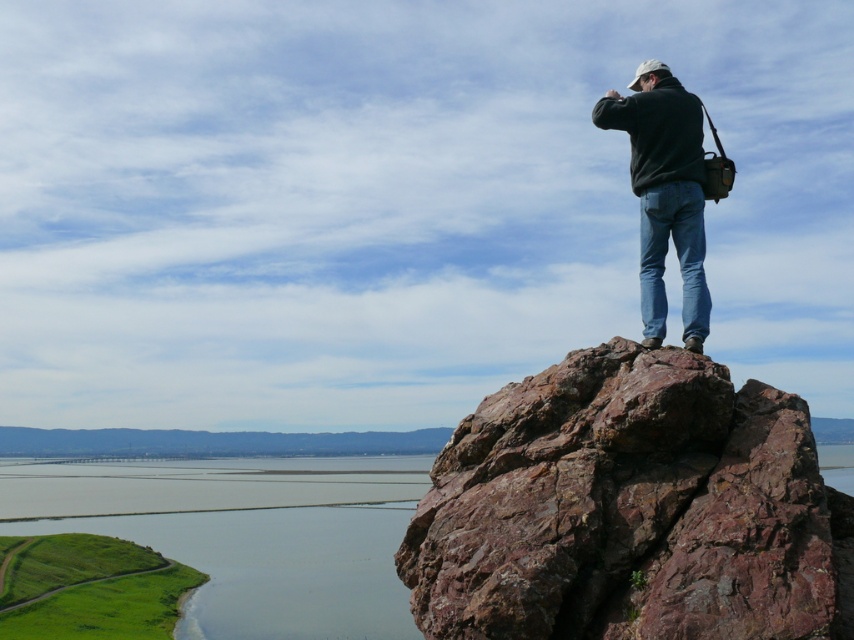
You are a photographer planning to capture the rusty rock at upper right and the black matte jacket at upper right in the same frame. Given their sizes, which object should you focus on first to ensure both are in the frame without moving the camera?

The rusty rock at upper right is wider than the black matte jacket at upper right, so you should focus on the rusty rock at upper right first to ensure both fit in the frame.

You are a hiker who wants to place a 2.5 meter long tent between the rusty rock at upper right and the black matte jacket at upper right. Can you fit the tent between them?

The rusty rock at upper right and black matte jacket at upper right are 2.68 meters apart, so the 2.5 meter long tent can fit between them since the distance is slightly larger than the tent length.

You are a photographer positioned at the base of the rock formation. You want to capture both the rusty rock at upper right and the black matte jacket at upper right in your frame. Which object should you focus on first to ensure both are in focus?

You should focus on the rusty rock at upper right first because it is closer to the viewer than the black matte jacket at upper right, so adjusting focus from near to far will help both objects be in focus.